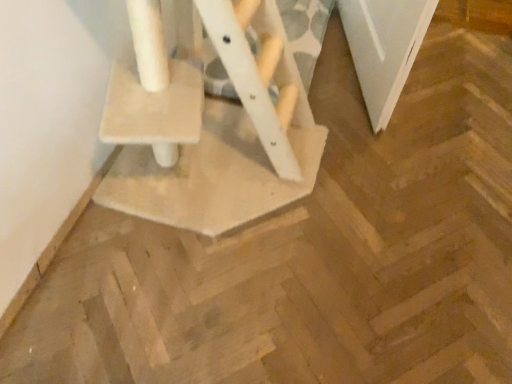
This screenshot has width=512, height=384. Find the location of `free location to the right of beige textured cat tree at center`. free location to the right of beige textured cat tree at center is located at coordinates (388, 195).